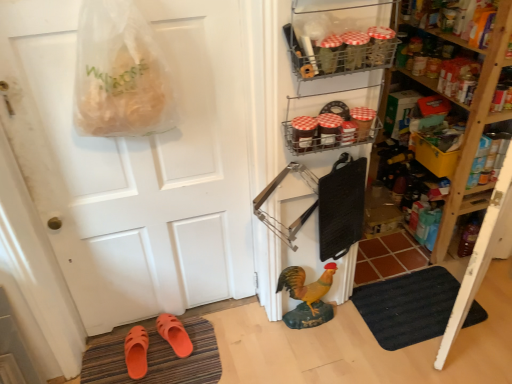
You are a GUI agent. You are given a task and a screenshot of the screen. Output one action in this format:
    pyautogui.click(x=<x>, y=<y>)
    Task: Click on the vacant area that lies between orange rubber slippers at lower left, which ranks as the 2th footwear in right-to-left order, and orange rubber slippers at lower left, arranged as the 1th footwear when viewed from the right
    Image resolution: width=512 pixels, height=384 pixels.
    Given the screenshot: What is the action you would take?
    pyautogui.click(x=157, y=355)